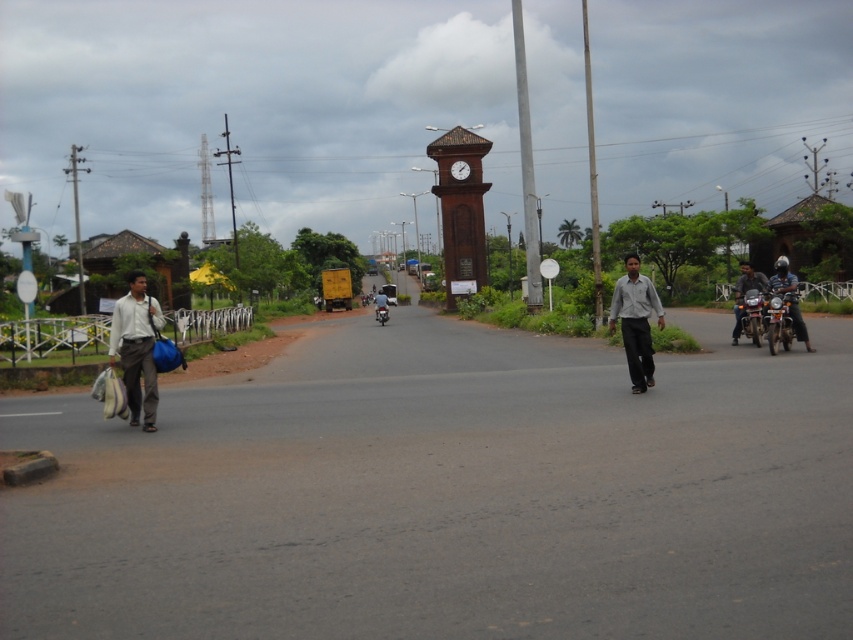
Is point (467, 272) positioned before point (809, 348)?

No, (467, 272) is behind (809, 348).

Who is taller, brown wooden clock tower at center or dark blue helmeted rider at right?

With more height is brown wooden clock tower at center.

The height and width of the screenshot is (640, 853). Find the location of `brown wooden clock tower at center`. brown wooden clock tower at center is located at coordinates (461, 211).

Looking at this image, between dark blue shirt at right and metallic silver motorcycle at center, which one has less height?

With less height is metallic silver motorcycle at center.

Does dark blue shirt at right appear under metallic silver motorcycle at center?

Incorrect, dark blue shirt at right is not positioned below metallic silver motorcycle at center.

The image size is (853, 640). Describe the element at coordinates (744, 291) in the screenshot. I see `dark blue shirt at right` at that location.

Where is `dark blue shirt at right`? This screenshot has width=853, height=640. dark blue shirt at right is located at coordinates (744, 291).

Based on the photo, is brown wooden clock tower at center shorter than light gray fabric bag at left?

No.

Can you confirm if brown wooden clock tower at center is taller than light gray fabric bag at left?

Correct, brown wooden clock tower at center is much taller as light gray fabric bag at left.

This screenshot has height=640, width=853. I want to click on brown wooden clock tower at center, so click(x=461, y=211).